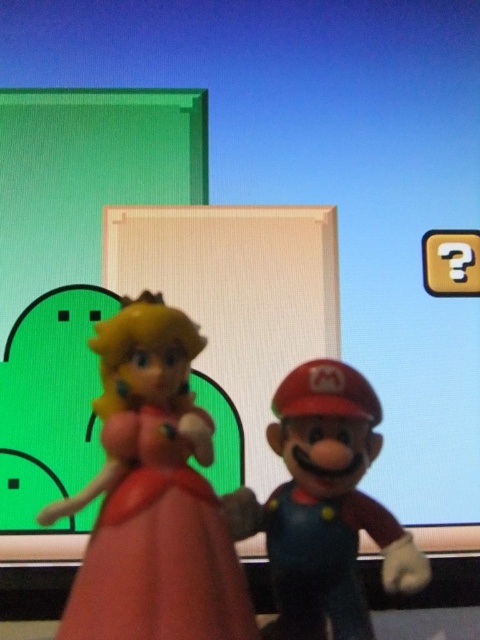
You are a photographer trying to capture a closeup shot of the matte pink princess at center. Your camera has a minimum focusing distance of 20 inches. Can you take the photo without moving either the camera or the princess?

The matte pink princess at center and camera are 22.72 inches apart from each other. Since the minimum focusing distance is 20 inches, the camera can focus on the matte pink princess at center and take the photo without moving either.

You are playing a video game where you need to place a new powerup at the same position as the matte pink princess at center. What coordinates should you use?

The coordinates for the matte pink princess at center are at point (153, 496).

From the picture: You are a collector who wants to display both the matte pink princess at center and the matte plastic mario at center on a shelf. Given that the shelf has limited space, which figurine should you place first to ensure both can fit?

The matte pink princess at center is larger than the matte plastic mario at center, so you should place the matte pink princess at center first to ensure both can fit on the shelf.